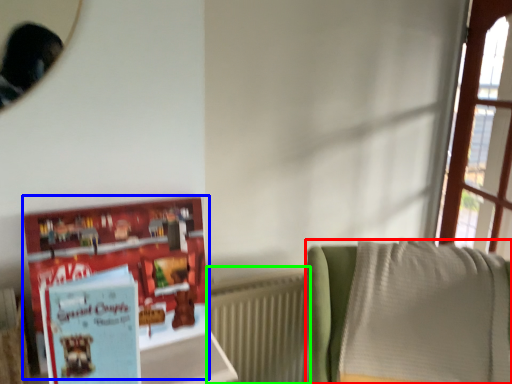
Question: Considering the real-world distances, which object is closest to furniture (highlighted by a red box)? book (highlighted by a blue box) or radiator (highlighted by a green box).

Choices:
 (A) book
 (B) radiator

Answer: (B)